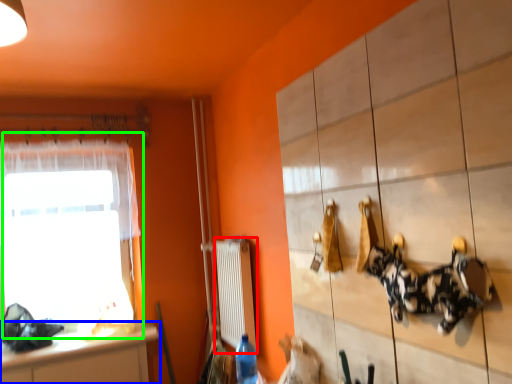
Question: Which object is positioned farthest from radiator (highlighted by a red box)? Select from countertop (highlighted by a blue box) and window (highlighted by a green box).

Choices:
 (A) countertop
 (B) window

Answer: (B)